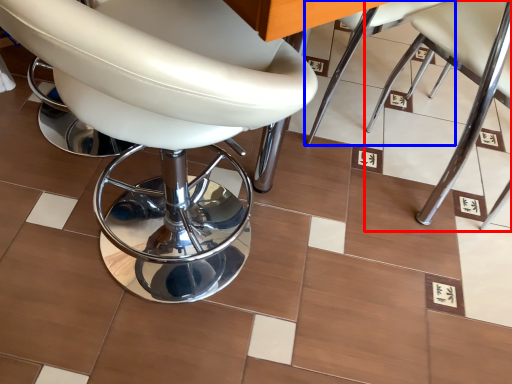
Question: Which object is further to the camera taking this photo, chair (highlighted by a red box) or chair (highlighted by a blue box)?

Choices:
 (A) chair
 (B) chair

Answer: (B)